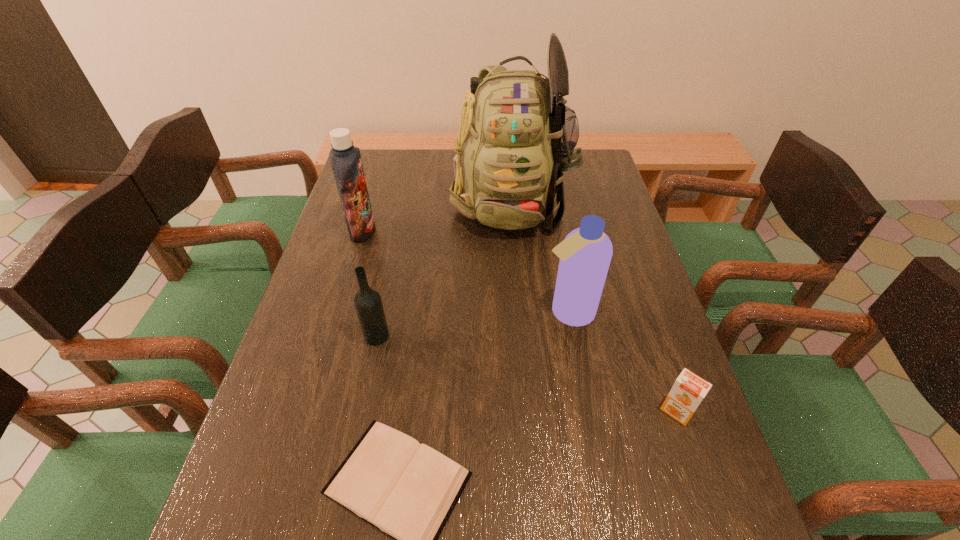
Where is `backpack`? The width and height of the screenshot is (960, 540). backpack is located at coordinates (516, 137).

Find the location of a particular element. Image resolution: width=960 pixels, height=540 pixels. the left shampoo is located at coordinates (345, 159).

I want to click on the leftmost object, so tap(345, 159).

The image size is (960, 540). In order to click on the nearer shampoo in this screenshot , I will do `click(585, 254)`.

Identify the location of the fourth tallest object. This screenshot has height=540, width=960. (368, 304).

Find the location of a particular element. This screenshot has height=540, width=960. orange juice is located at coordinates (688, 391).

Identify the location of the second shortest object. This screenshot has width=960, height=540. (688, 391).

This screenshot has width=960, height=540. In order to click on blank space located 0.370m on the front-facing side of the tallest object in this screenshot , I will do `click(524, 351)`.

At what (x,y) coordinates should I click in order to perform the action: click on vacant position located on the front label of the farther shampoo. Please return your answer as a coordinate pair (x, y). Image resolution: width=960 pixels, height=540 pixels. Looking at the image, I should click on (438, 230).

Where is `blank space located 0.230m on the front of the right shampoo`? blank space located 0.230m on the front of the right shampoo is located at coordinates coord(588,419).